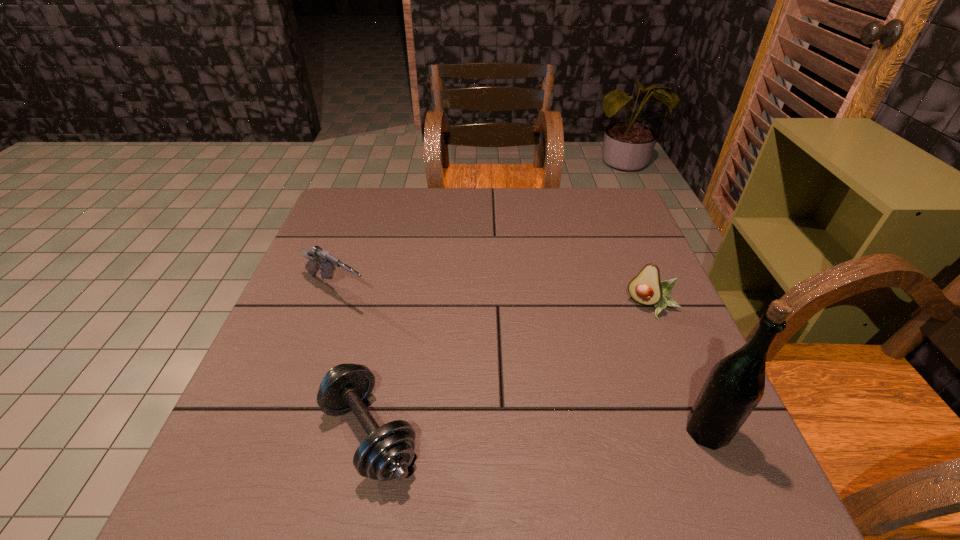
The height and width of the screenshot is (540, 960). What are the coordinates of `dumbbell` in the screenshot? It's located at (385, 454).

What are the coordinates of `beer bottle` in the screenshot? It's located at (735, 385).

At what (x,y) coordinates should I click in order to perform the action: click on gun. Please return your answer as a coordinate pair (x, y). The width and height of the screenshot is (960, 540). Looking at the image, I should click on (318, 257).

Image resolution: width=960 pixels, height=540 pixels. What are the coordinates of `avocado` in the screenshot? It's located at (646, 288).

The width and height of the screenshot is (960, 540). Identify the location of vacant space located 0.380m on the right of the dumbbell. (636, 434).

Where is `free point located 0.360m on the left of the beer bottle`? free point located 0.360m on the left of the beer bottle is located at coordinates (481, 431).

Identify the location of free location located 0.080m at the barrel of the gun. The image size is (960, 540). (387, 319).

The image size is (960, 540). What are the coordinates of `vacant region located at the barrel of the gun` in the screenshot? It's located at (470, 373).

At what (x,y) coordinates should I click in order to perform the action: click on free space located 0.270m at the barrel of the gun. Please return your answer as a coordinate pair (x, y). The height and width of the screenshot is (540, 960). Looking at the image, I should click on (451, 360).

Where is `vacant region located on the seed side of the avocado`? vacant region located on the seed side of the avocado is located at coordinates (624, 349).